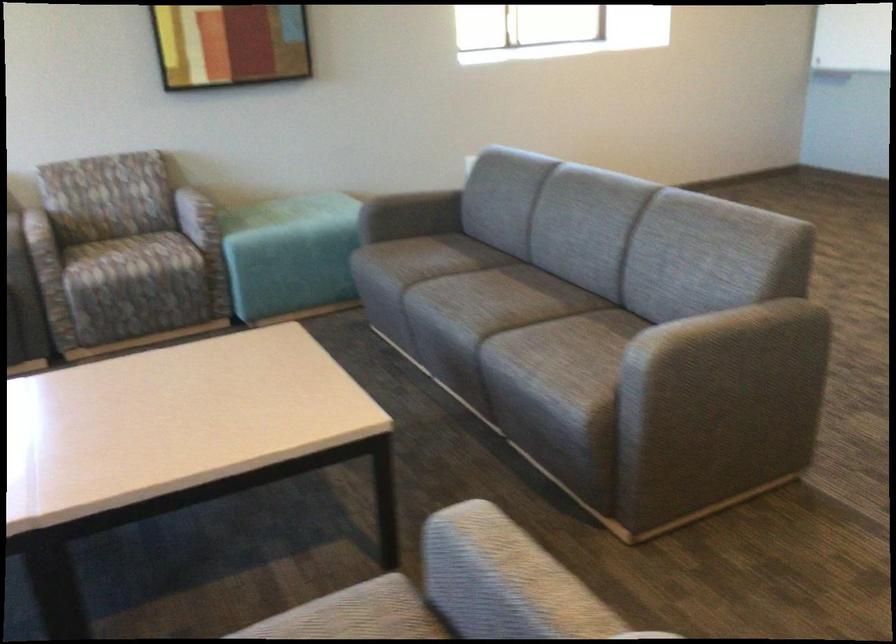
The width and height of the screenshot is (896, 644). In order to click on sofa sitting surface in this screenshot , I will do `click(503, 297)`.